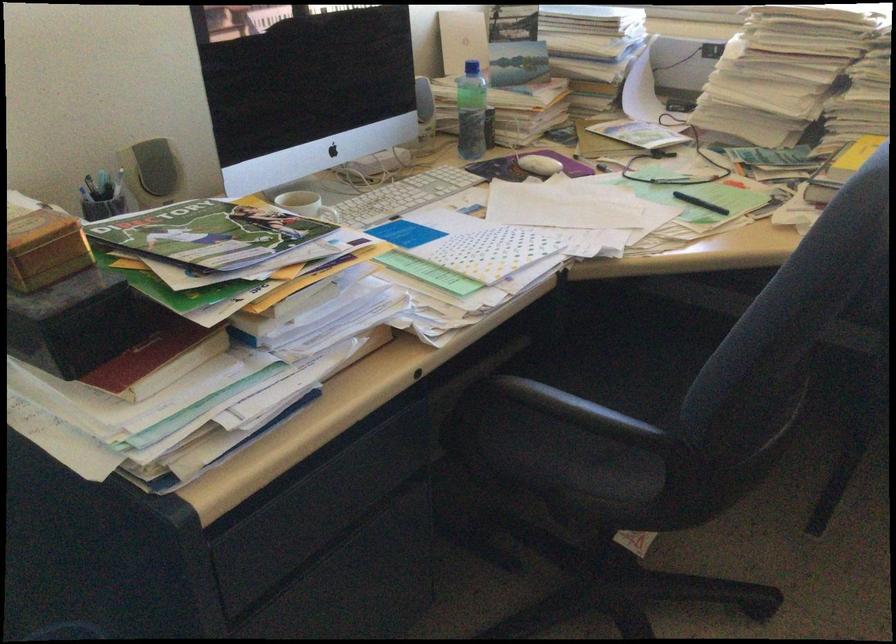
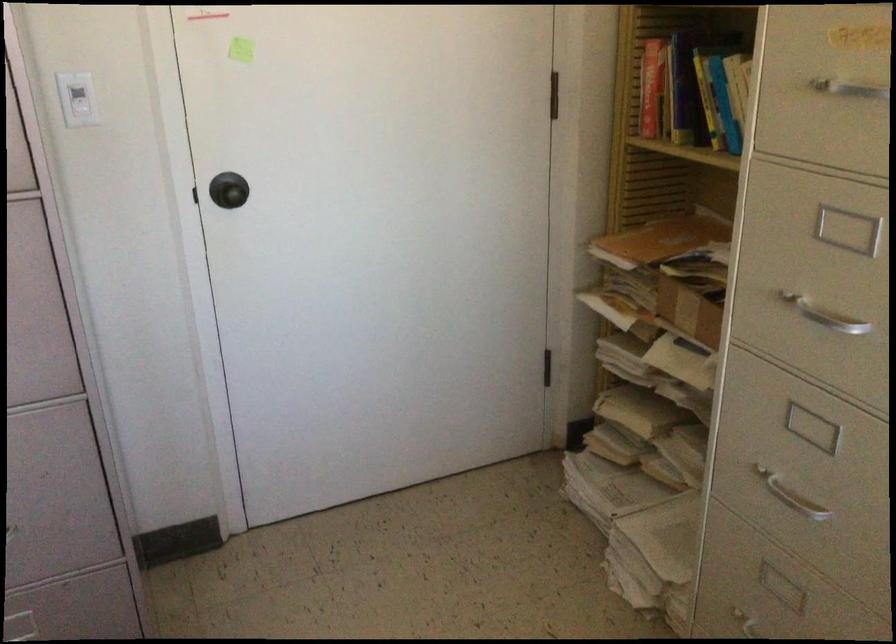
How did the camera likely rotate?

The camera's rotation is toward left-down.